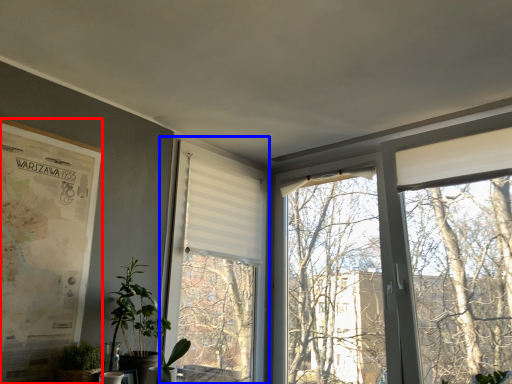
Question: Which object appears farthest to the camera in this image, poster page (highlighted by a red box) or window screen (highlighted by a blue box)?

Choices:
 (A) poster page
 (B) window screen

Answer: (B)